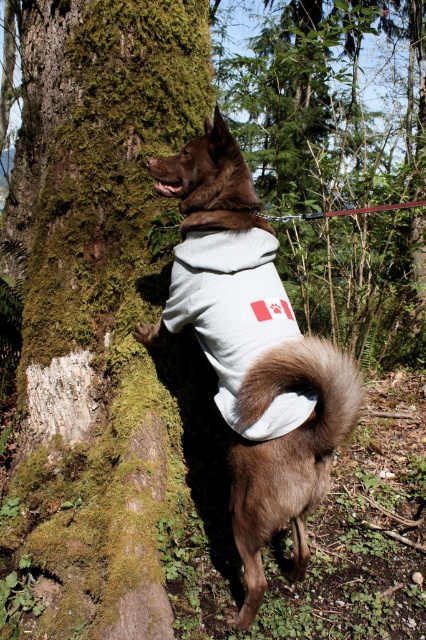
You are a hiker in the forest and notice the green mossy bark at left and the brown fur coat at center. Which object is located higher up in the image?

The green mossy bark at left is positioned over the brown fur coat at center, so it is higher up in the image.

You are a hiker who wants to take a photo of the brown fur coat at center and the green mossy bark at left. Since you want both to be in focus, which one should you focus on first?

The brown fur coat at center is behind green mossy bark at left, so you should focus on the green mossy bark at left first to ensure both are in focus.

You are a dog owner who wants to ensure your dog stays within a 3 feet distance from the green mossy bark at left while walking. Based on the scene, is the current position of the brown fur coat at center safe?

The green mossy bark at left is 3.94 feet away from the brown fur coat at center. Since the required distance is 3 feet, the current position exceeds the allowed distance, so the brown fur coat at center is not within the 3 feet safety zone.